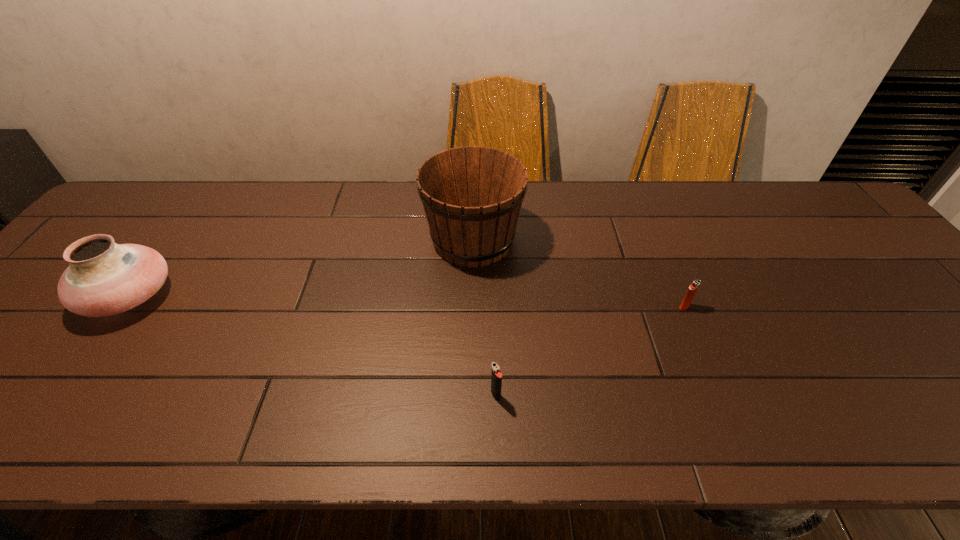
You are a GUI agent. You are given a task and a screenshot of the screen. Output one action in this format:
    pyautogui.click(x=<x>, y=<y>)
    Task: Click on the free space located on the back of the rightmost object
    Image resolution: width=960 pixels, height=540 pixels.
    Given the screenshot: What is the action you would take?
    pyautogui.click(x=646, y=215)

Find the location of a particular element. The image size is (960, 540). object located in the far edge section of the desktop is located at coordinates (472, 196).

The image size is (960, 540). I want to click on object that is at the left edge, so click(x=104, y=278).

You are a GUI agent. You are given a task and a screenshot of the screen. Output one action in this format:
    pyautogui.click(x=<x>, y=<y>)
    Task: Click on the vacant space at the far edge of the desktop
    The height and width of the screenshot is (540, 960).
    Given the screenshot: What is the action you would take?
    pyautogui.click(x=284, y=199)

The image size is (960, 540). In the image, there is a desktop. Identify the location of vacant space at the near edge. (883, 418).

Where is `vacant position at the right edge of the desktop`? Image resolution: width=960 pixels, height=540 pixels. vacant position at the right edge of the desktop is located at coordinates (955, 334).

Where is `free space at the far left corner of the desktop`? free space at the far left corner of the desktop is located at coordinates (119, 215).

The height and width of the screenshot is (540, 960). Find the location of `free space between the tallest object and the nearest object`. free space between the tallest object and the nearest object is located at coordinates (485, 318).

You are a GUI agent. You are given a task and a screenshot of the screen. Output one action in this format:
    pyautogui.click(x=<x>, y=<y>)
    Task: Click on the free space that is in between the shorter igniter and the second tallest object
    
    Given the screenshot: What is the action you would take?
    pyautogui.click(x=407, y=302)

Find the location of a particular element. The width and height of the screenshot is (960, 540). free space between the nearer igniter and the tallest object is located at coordinates (485, 318).